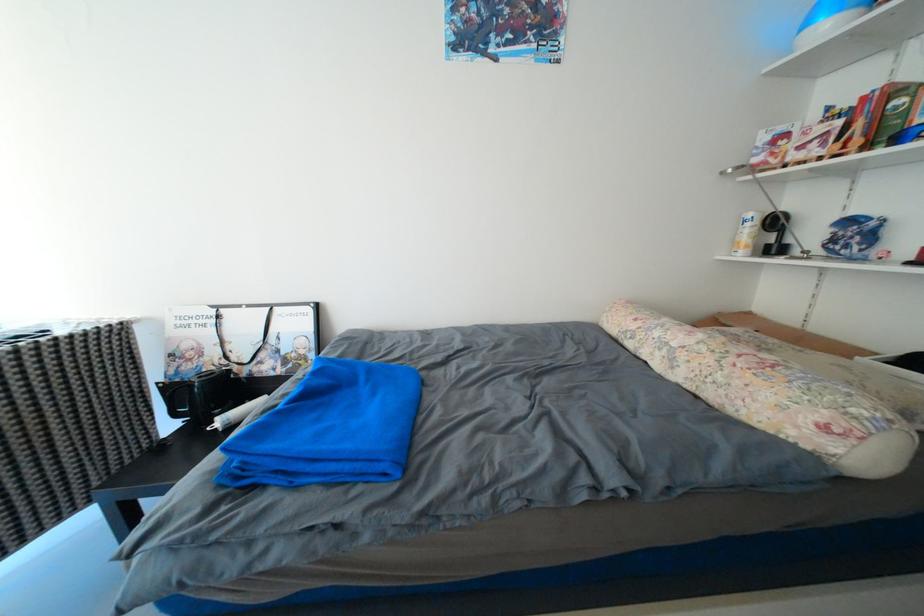
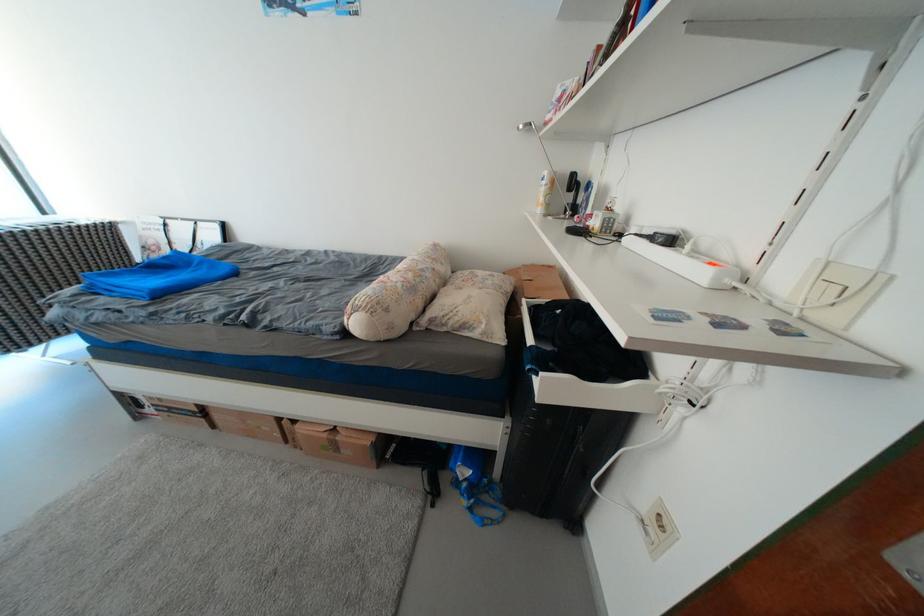
In the second image, find the point that corresponds to point 771,135 in the first image.

(567, 89)